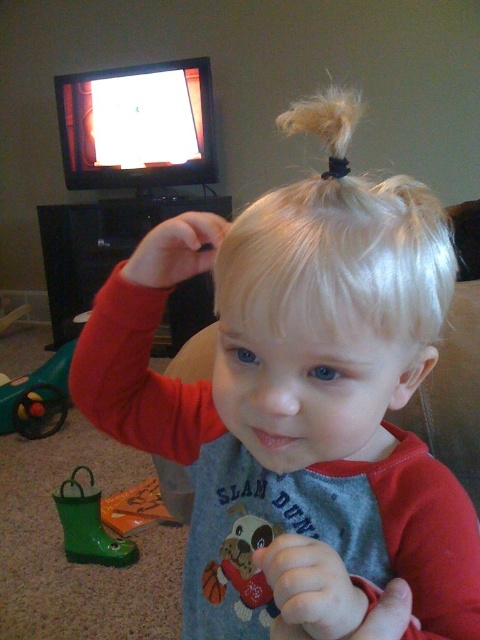
Which is behind, point (345, 145) or point (111, 509)?

Point (111, 509)

Is fuzzy blonde hair at top below rubber green boot at lower left?

No.

Does point (345, 154) come farther from viewer compared to point (130, 515)?

No.

Identify the location of fuzzy blonde hair at top. (325, 124).

Between soft plush dog at center and rubber green boot at lower left, which one appears on the left side from the viewer's perspective?

rubber green boot at lower left is more to the left.

Does point (278, 525) lie behind point (120, 518)?

No, (278, 525) is in front of (120, 518).

Image resolution: width=480 pixels, height=640 pixels. Describe the element at coordinates (241, 568) in the screenshot. I see `soft plush dog at center` at that location.

Where is `soft plush dog at center`? soft plush dog at center is located at coordinates (241, 568).

Who is taller, green rubber toy at lower left or rubber green boot at lower left?

With more height is green rubber toy at lower left.

Does point (38, 376) come behind point (127, 518)?

Yes, it is.

Where is `green rubber toy at lower left`? Image resolution: width=480 pixels, height=640 pixels. green rubber toy at lower left is located at coordinates click(37, 397).